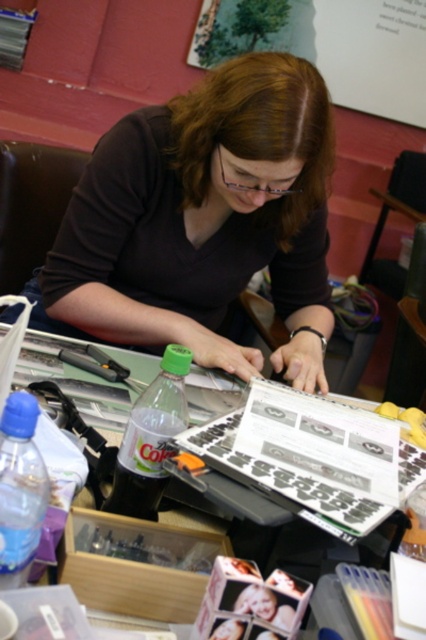
You are organizing a desk and need to know which object is wider. You see the wooden bulletin board at upper center and the clear plastic table at center. Which one is wider?

The wooden bulletin board at upper center is wider than the clear plastic table at center according to the description.

You are a person sitting at the desk in the image. You need to reach for a point located at coordinates point [164,168] and another point at point [288,24]. Which point will your hand reach first if you move it straight towards both points simultaneously?

Point [164,168] will be reached first because it is in front of point [288,24].